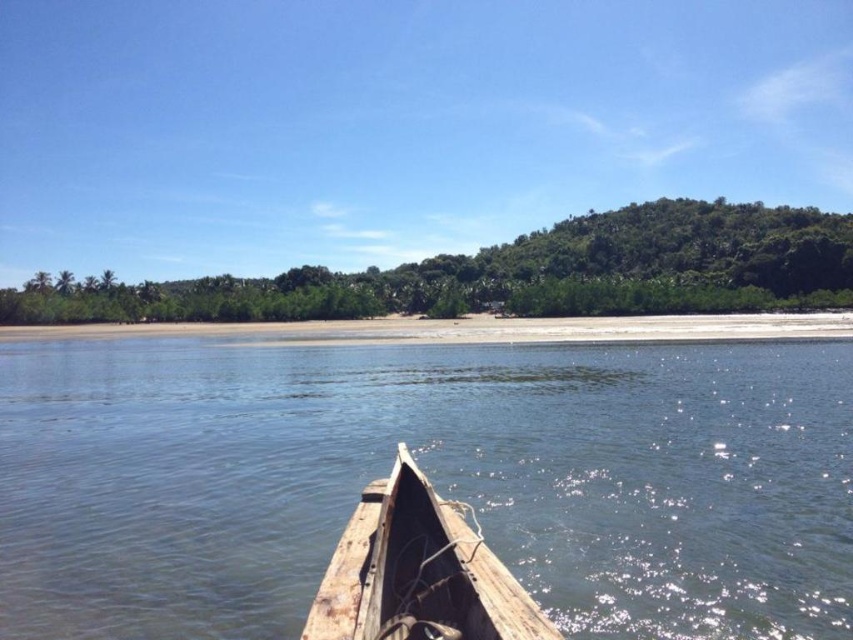
Question: Is wooden boat at lower center in front of weathered wood boat at lower center?

Choices:
 (A) yes
 (B) no

Answer: (B)

Question: Based on their relative distances, which object is farther from the wooden boat at lower center?

Choices:
 (A) weathered wood boat at lower center
 (B) sandy beach at lower center

Answer: (B)

Question: Can you confirm if wooden boat at lower center is positioned above weathered wood boat at lower center?

Choices:
 (A) no
 (B) yes

Answer: (B)

Question: Which point is closer to the camera taking this photo?

Choices:
 (A) (368, 506)
 (B) (762, 384)

Answer: (A)

Question: Can you confirm if weathered wood boat at lower center is positioned above sandy beach at lower center?

Choices:
 (A) yes
 (B) no

Answer: (B)

Question: Which of the following is the farthest from the observer?

Choices:
 (A) pyautogui.click(x=410, y=333)
 (B) pyautogui.click(x=805, y=388)

Answer: (A)